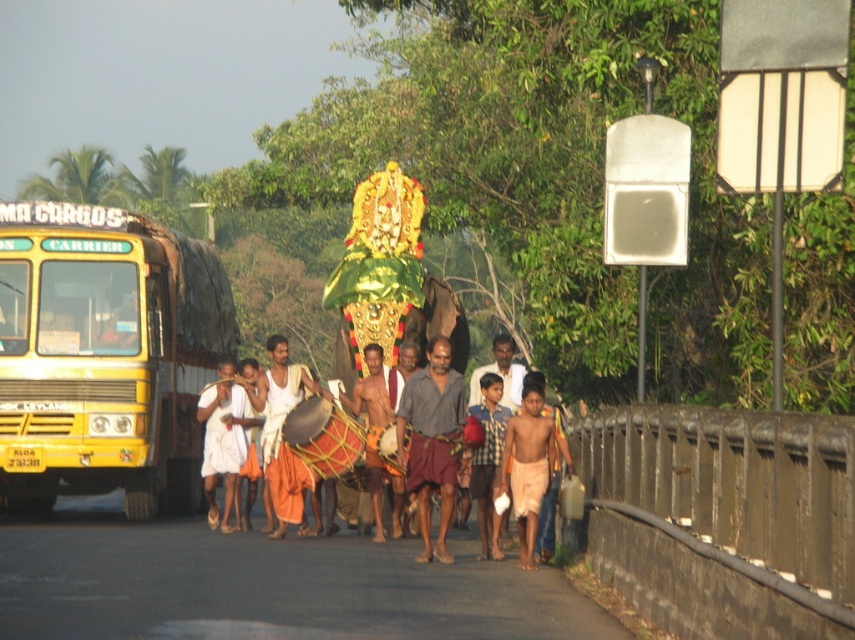
Can you confirm if gray cotton shirt at center is thinner than white cotton cloth at center?

Yes, gray cotton shirt at center is thinner than white cotton cloth at center.

Identify the location of gray cotton shirt at center. (432, 442).

Where is `gray cotton shirt at center`? Image resolution: width=855 pixels, height=640 pixels. gray cotton shirt at center is located at coordinates (432, 442).

This screenshot has height=640, width=855. What do you see at coordinates (487, 461) in the screenshot? I see `checkered fabric shirt at center` at bounding box center [487, 461].

Does checkered fabric shirt at center have a lesser height compared to shiny golden drum at center?

Correct, checkered fabric shirt at center is not as tall as shiny golden drum at center.

This screenshot has height=640, width=855. I want to click on checkered fabric shirt at center, so click(487, 461).

Between gray cotton shirt at center and checkered fabric shirt at center, which one has less height?

Standing shorter between the two is checkered fabric shirt at center.

Is gray cotton shirt at center to the right of checkered fabric shirt at center from the viewer's perspective?

In fact, gray cotton shirt at center is to the left of checkered fabric shirt at center.

Locate an element on the screen. Image resolution: width=855 pixels, height=640 pixels. gray cotton shirt at center is located at coordinates (432, 442).